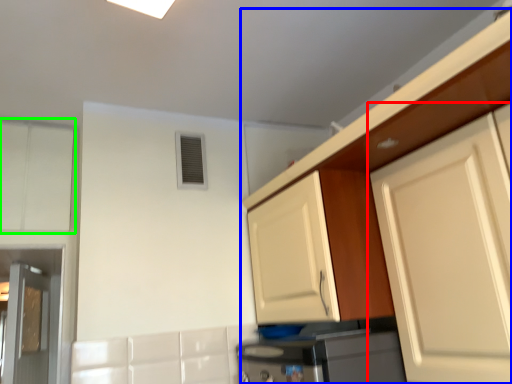
Question: Estimate the real-world distances between objects in this image. Which object is closer to cabinetry (highlighted by a red box), cabinetry (highlighted by a blue box) or cabinetry (highlighted by a green box)?

Choices:
 (A) cabinetry
 (B) cabinetry

Answer: (A)